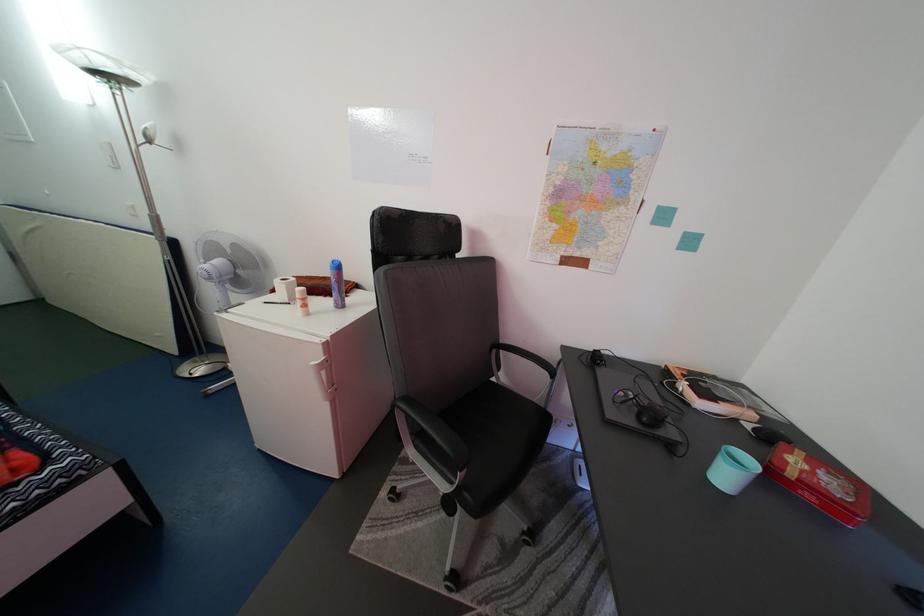
Locate an element on the screen. The image size is (924, 616). white desk fan is located at coordinates (225, 282).